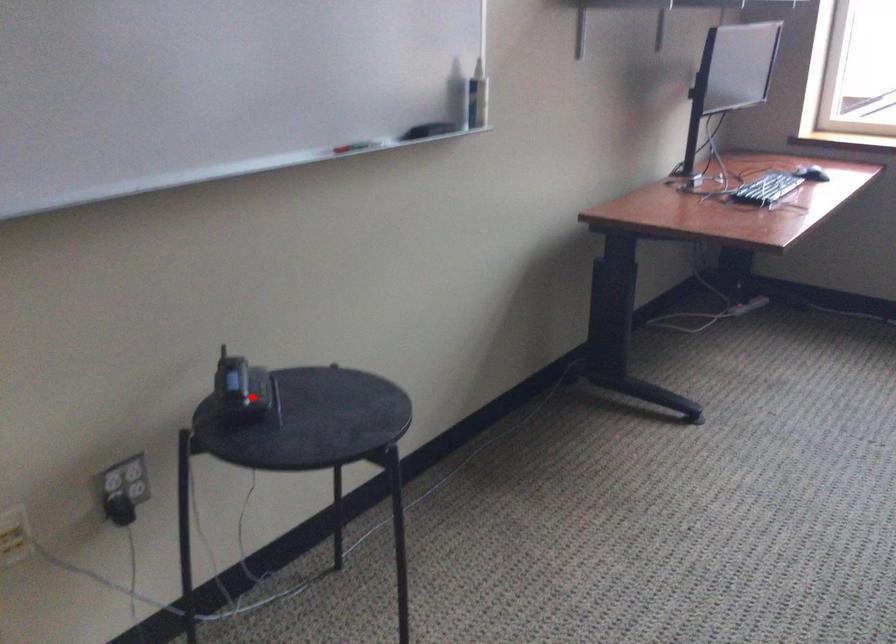
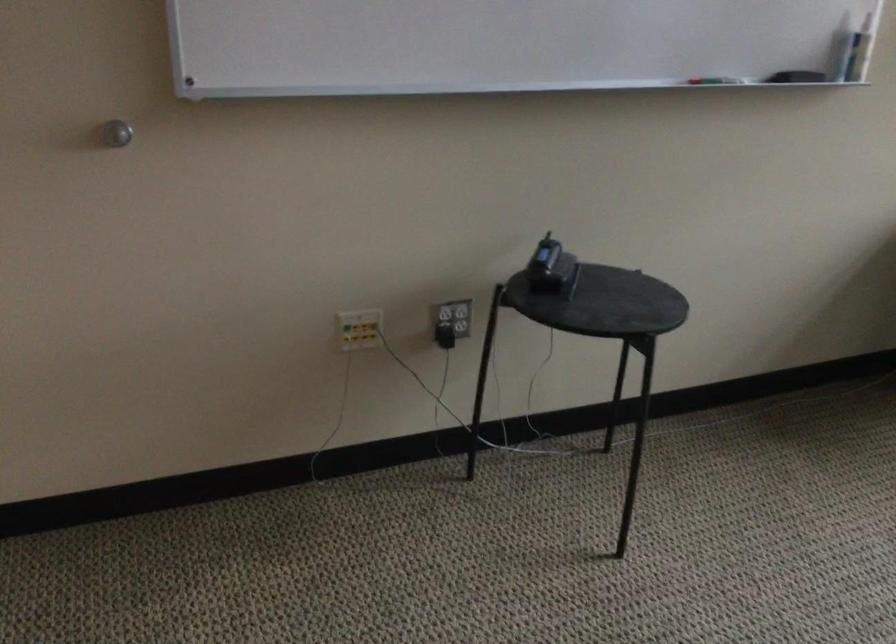
Question: I am providing you with two images of the same scene from different viewpoints. In image1, a red point is highlighted. Considering the same 3D point in image2, which of the following is correct?

Choices:
 (A) It is closer
 (B) It is farther

Answer: (B)